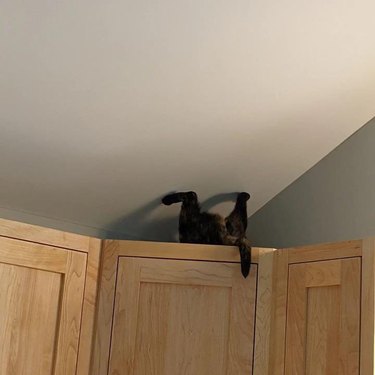
The image size is (375, 375). I want to click on blond wood cabinet, so click(x=201, y=318).